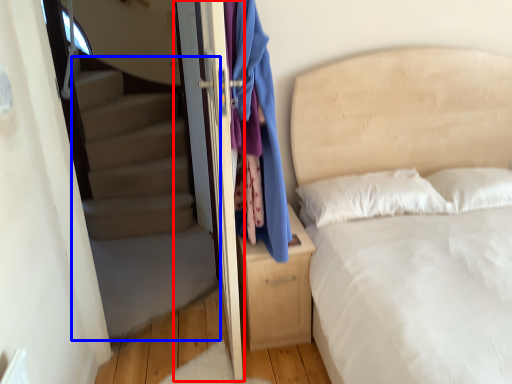
Question: Among these objects, which one is farthest to the camera, screen door (highlighted by a red box) or stairwell (highlighted by a blue box)?

Choices:
 (A) screen door
 (B) stairwell

Answer: (B)